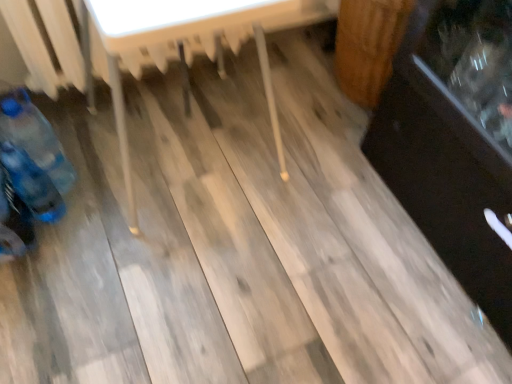
Question: Can you confirm if blue plastic bottle at lower left, positioned as the 2th bottle in top-to-bottom order, is smaller than wooden table at center?

Choices:
 (A) yes
 (B) no

Answer: (A)

Question: Can you confirm if blue plastic bottle at lower left, positioned as the 2th bottle in top-to-bottom order, is positioned to the left of wooden table at center?

Choices:
 (A) no
 (B) yes

Answer: (B)

Question: Does blue plastic bottle at lower left, the first bottle in the bottom-to-top sequence, contain wooden table at center?

Choices:
 (A) yes
 (B) no

Answer: (B)

Question: Is blue plastic bottle at lower left, positioned as the 2th bottle in top-to-bottom order, oriented away from wooden table at center?

Choices:
 (A) yes
 (B) no

Answer: (B)

Question: Is blue plastic bottle at lower left, the first bottle in the bottom-to-top sequence, placed right next to wooden table at center?

Choices:
 (A) no
 (B) yes

Answer: (A)

Question: From a real-world perspective, is blue plastic bottle at lower left, the first bottle in the bottom-to-top sequence, positioned over wooden table at center based on gravity?

Choices:
 (A) yes
 (B) no

Answer: (B)

Question: Is blue plastic bottle at left, arranged as the 1th bottle when viewed from the top, aimed at blue plastic bottle at lower left, the first bottle in the bottom-to-top sequence?

Choices:
 (A) no
 (B) yes

Answer: (B)

Question: Considering the relative positions of blue plastic bottle at left, marked as the 2th bottle in a bottom-to-top arrangement, and blue plastic bottle at lower left, the first bottle in the bottom-to-top sequence, in the image provided, is blue plastic bottle at left, marked as the 2th bottle in a bottom-to-top arrangement, to the right of blue plastic bottle at lower left, the first bottle in the bottom-to-top sequence, from the viewer's perspective?

Choices:
 (A) no
 (B) yes

Answer: (A)

Question: Would you say blue plastic bottle at left, arranged as the 1th bottle when viewed from the top, is outside blue plastic bottle at lower left, the first bottle in the bottom-to-top sequence?

Choices:
 (A) yes
 (B) no

Answer: (A)

Question: Is there a large distance between blue plastic bottle at left, marked as the 2th bottle in a bottom-to-top arrangement, and blue plastic bottle at lower left, positioned as the 2th bottle in top-to-bottom order?

Choices:
 (A) no
 (B) yes

Answer: (A)

Question: Is blue plastic bottle at left, arranged as the 1th bottle when viewed from the top, wider than blue plastic bottle at lower left, the first bottle in the bottom-to-top sequence?

Choices:
 (A) yes
 (B) no

Answer: (A)

Question: Is blue plastic bottle at left, arranged as the 1th bottle when viewed from the top, at the left side of blue plastic bottle at lower left, positioned as the 2th bottle in top-to-bottom order?

Choices:
 (A) yes
 (B) no

Answer: (A)

Question: From a real-world perspective, does blue plastic bottle at left, marked as the 2th bottle in a bottom-to-top arrangement, stand above wooden table at center?

Choices:
 (A) no
 (B) yes

Answer: (A)